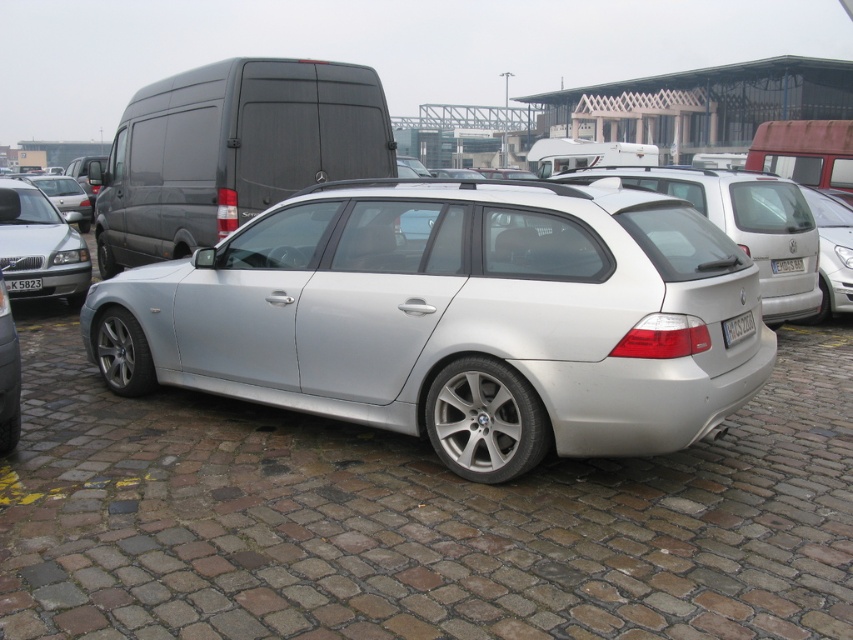
Question: Among these points, which one is nearest to the camera?

Choices:
 (A) (186, 99)
 (B) (84, 268)

Answer: (A)

Question: Can you confirm if matte black van at upper left is positioned below white plastic license plate at rear?

Choices:
 (A) no
 (B) yes

Answer: (A)

Question: Considering the real-world distances, which object is farthest from the matte black van at upper left?

Choices:
 (A) white plastic license plate at rear
 (B) matte silver car at left

Answer: (B)

Question: Considering the relative positions of silver metallic sedan at left and black plastic license plate at center in the image provided, where is silver metallic sedan at left located with respect to black plastic license plate at center?

Choices:
 (A) below
 (B) above

Answer: (B)

Question: Which of the following is the closest to the observer?

Choices:
 (A) (38, 289)
 (B) (26, 234)
 (C) (744, 332)

Answer: (C)

Question: Can you confirm if silver metallic car at center is smaller than matte black van at upper left?

Choices:
 (A) yes
 (B) no

Answer: (B)